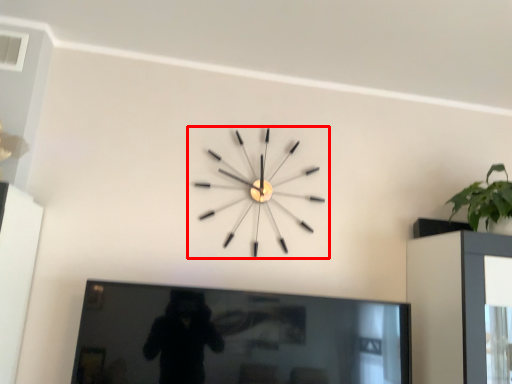
Question: From the image's perspective, what is the correct spatial positioning of wall clock (annotated by the red box) in reference to picture frame?

Choices:
 (A) above
 (B) below

Answer: (A)